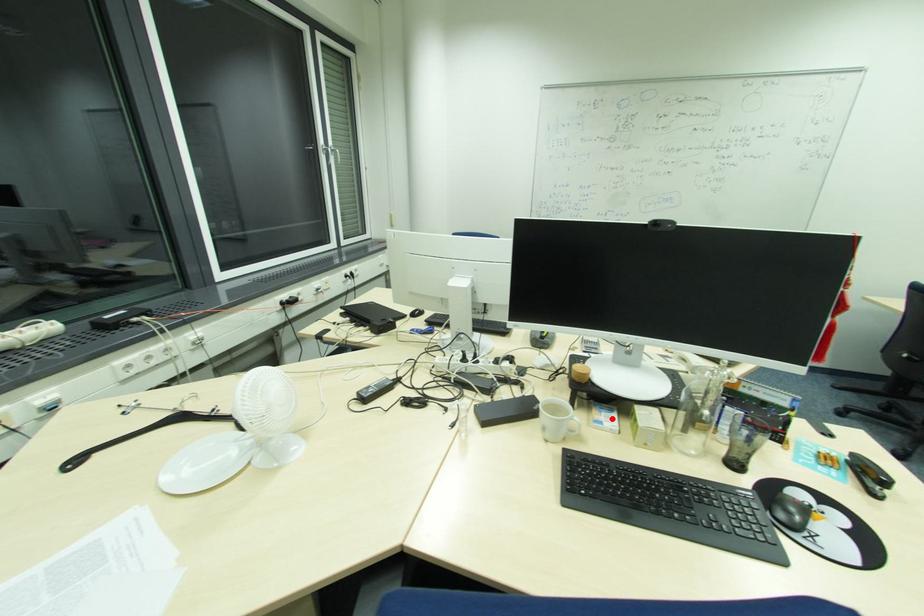
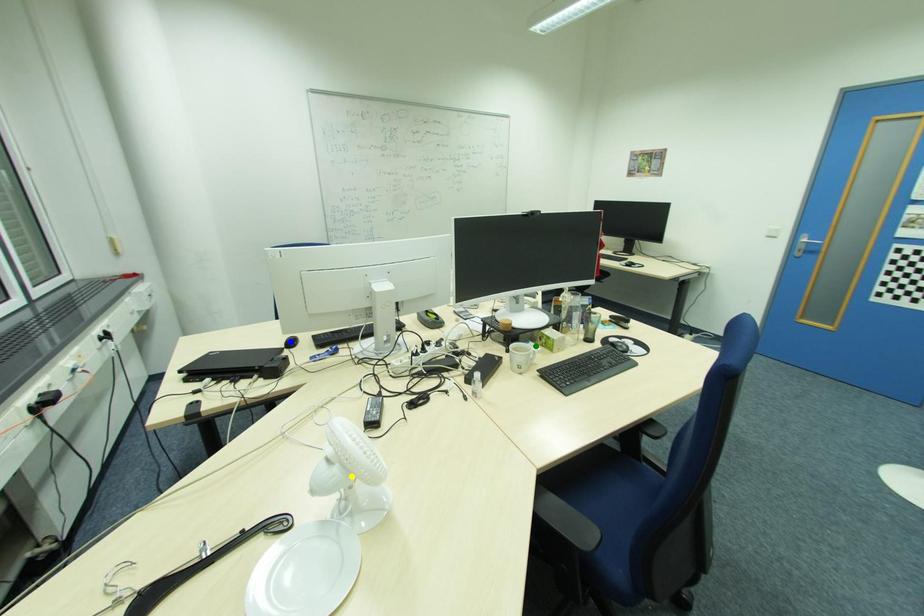
Question: I am providing you with two images of the same scene from different viewpoints. A red point is marked on the first image. You are given multiple points on the second image. In image 2, which mark is for the same physical point as the one in image 1?

Choices:
 (A) yellow point
 (B) blue point
 (C) green point

Answer: (C)